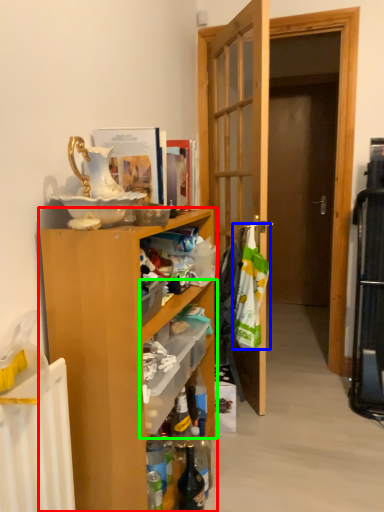
Question: Which is farther away from cabinetry (highlighted by a red box)? laundry (highlighted by a blue box) or shelf (highlighted by a green box)?

Choices:
 (A) laundry
 (B) shelf

Answer: (A)